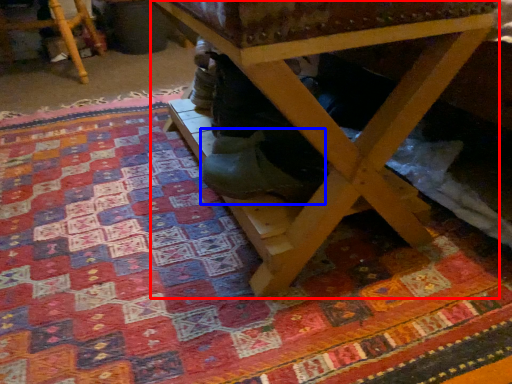
Question: Which object is further to the camera taking this photo, table (highlighted by a red box) or shoe (highlighted by a blue box)?

Choices:
 (A) table
 (B) shoe

Answer: (B)